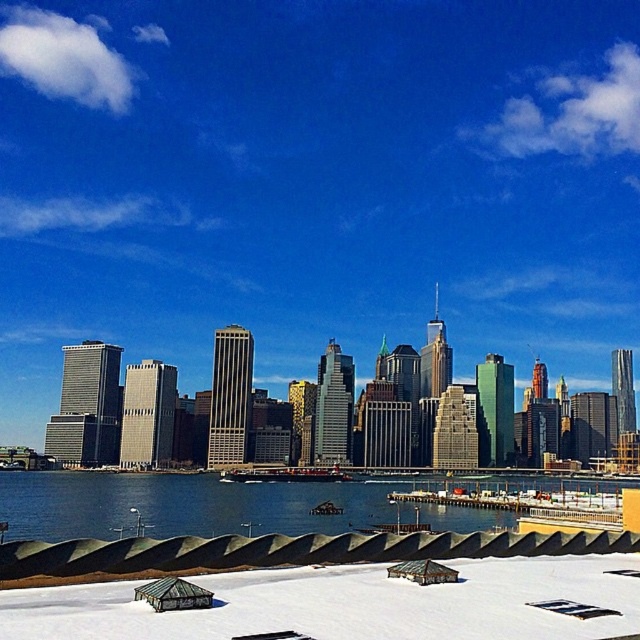
Question: Which of the following is the closest to the observer?

Choices:
 (A) (6, 512)
 (B) (476, 595)

Answer: (B)

Question: Does white matte snow at lower center appear under blue water at lower center?

Choices:
 (A) yes
 (B) no

Answer: (B)

Question: Which point is farther to the camera?

Choices:
 (A) (276, 500)
 (B) (49, 632)

Answer: (A)

Question: Is white matte snow at lower center bigger than blue water at lower center?

Choices:
 (A) yes
 (B) no

Answer: (B)

Question: Can you confirm if white matte snow at lower center is positioned to the right of blue water at lower center?

Choices:
 (A) yes
 (B) no

Answer: (A)